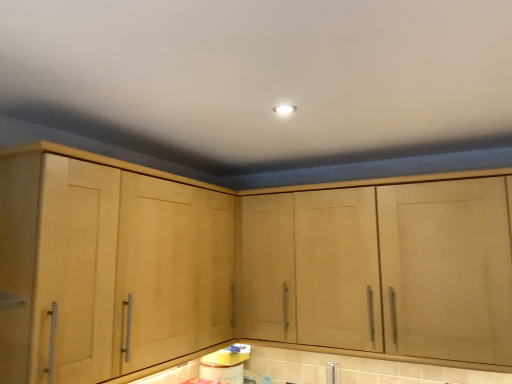
Question: From the image's perspective, is light wood cabinet at center, which is the 2th cabinetry in left-to-right order, located above or below light wood cabinet at left, which ranks as the first cabinetry in left-to-right order?

Choices:
 (A) below
 (B) above

Answer: (A)

Question: Does point (243, 261) appear closer or farther from the camera than point (52, 233)?

Choices:
 (A) farther
 (B) closer

Answer: (A)

Question: Which object is the farthest from the silver metallic faucet at lower center?

Choices:
 (A) light wood cabinet at left, the 2th cabinetry positioned from the right
 (B) light wood cabinet at center, which is the 2th cabinetry in left-to-right order

Answer: (A)

Question: Which object is positioned closest to the light wood cabinet at center, which is the 2th cabinetry in left-to-right order?

Choices:
 (A) light wood cabinet at left, which ranks as the first cabinetry in left-to-right order
 (B) silver metallic faucet at lower center

Answer: (B)